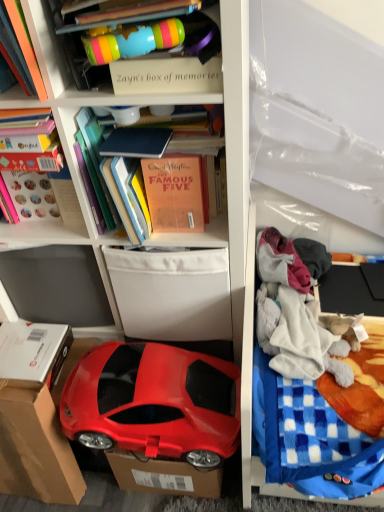
Question: Can you confirm if cardboard at lower left is thinner than blue checkered blanket at right?

Choices:
 (A) yes
 (B) no

Answer: (A)

Question: Is cardboard at lower left completely or partially outside of blue checkered blanket at right?

Choices:
 (A) no
 (B) yes

Answer: (B)

Question: Does cardboard at lower left have a smaller size compared to blue checkered blanket at right?

Choices:
 (A) yes
 (B) no

Answer: (A)

Question: Is cardboard at lower left placed right next to blue checkered blanket at right?

Choices:
 (A) no
 (B) yes

Answer: (A)

Question: Can you confirm if cardboard at lower left is taller than blue checkered blanket at right?

Choices:
 (A) no
 (B) yes

Answer: (A)

Question: Is matte orange book at upper left, which is the 2th book in right-to-left order, in front of or behind fluffy cotton blanket at right, which is the 2th clothing in top-to-bottom order, in the image?

Choices:
 (A) front
 (B) behind

Answer: (A)

Question: In terms of width, does matte orange book at upper left, which is the 2th book in right-to-left order, look wider or thinner when compared to fluffy cotton blanket at right, placed as the first clothing when sorted from bottom to top?

Choices:
 (A) wide
 (B) thin

Answer: (B)

Question: Is matte orange book at upper left, positioned as the 2th book in left-to-right order, inside the boundaries of fluffy cotton blanket at right, placed as the first clothing when sorted from bottom to top, or outside?

Choices:
 (A) inside
 (B) outside

Answer: (B)

Question: Is matte orange book at upper left, positioned as the 2th book in left-to-right order, taller or shorter than fluffy cotton blanket at right, which is the 2th clothing in top-to-bottom order?

Choices:
 (A) tall
 (B) short

Answer: (A)

Question: Based on their positions, is matte orange book at upper left, which is the 2th book in right-to-left order, located to the left or right of matte plastic cup at upper center?

Choices:
 (A) left
 (B) right

Answer: (A)

Question: From the image's perspective, is matte orange book at upper left, positioned as the 2th book in left-to-right order, located above or below matte plastic cup at upper center?

Choices:
 (A) below
 (B) above

Answer: (A)

Question: Is matte orange book at upper left, positioned as the 2th book in left-to-right order, wider or thinner than matte plastic cup at upper center?

Choices:
 (A) thin
 (B) wide

Answer: (A)

Question: In the image, is matte orange book at upper left, positioned as the 2th book in left-to-right order, positioned in front of or behind matte plastic cup at upper center?

Choices:
 (A) front
 (B) behind

Answer: (A)

Question: In the image, is shiny red car at lower left positioned in front of or behind orange matte book at upper center, acting as the first book starting from the right?

Choices:
 (A) behind
 (B) front

Answer: (A)

Question: Visually, is shiny red car at lower left positioned to the left or to the right of orange matte book at upper center, which is the third book in left-to-right order?

Choices:
 (A) right
 (B) left

Answer: (B)